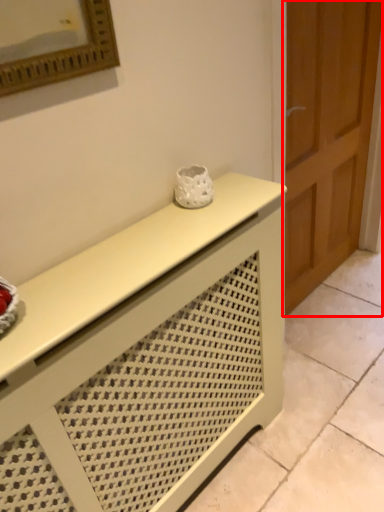
Question: From the image's perspective, where is door (annotated by the red box) located in relation to furniture in the image?

Choices:
 (A) above
 (B) below

Answer: (A)